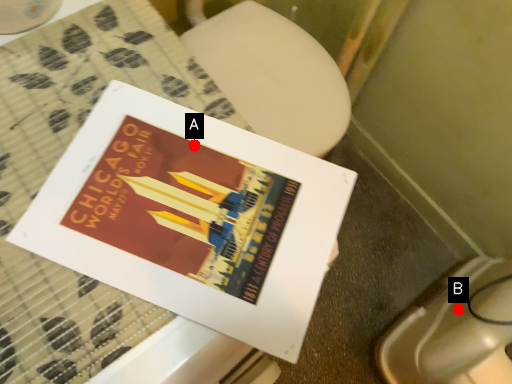
Question: Two points are circled on the image, labeled by A and B beside each circle. Which of the following is the farthest from the observer?

Choices:
 (A) A is further
 (B) B is further

Answer: (B)